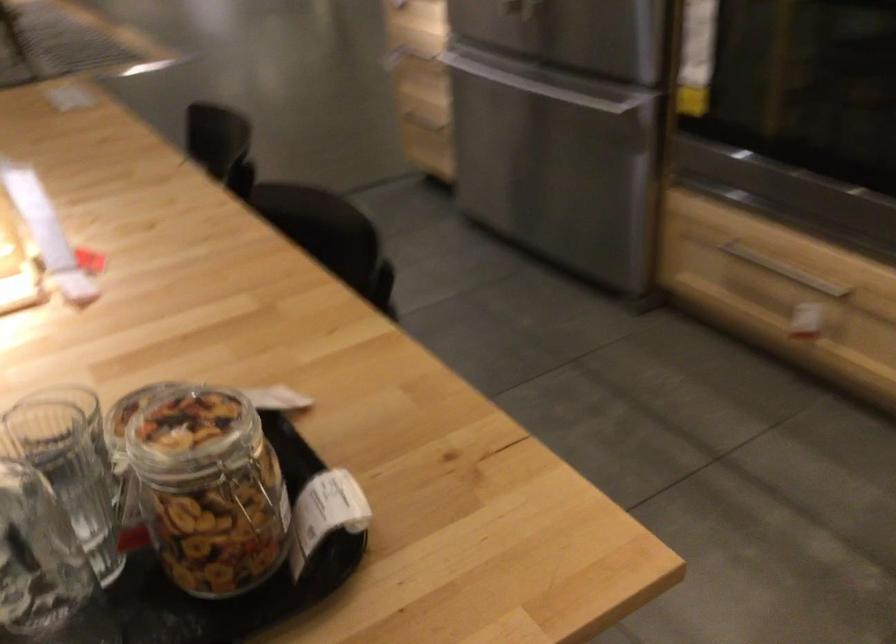
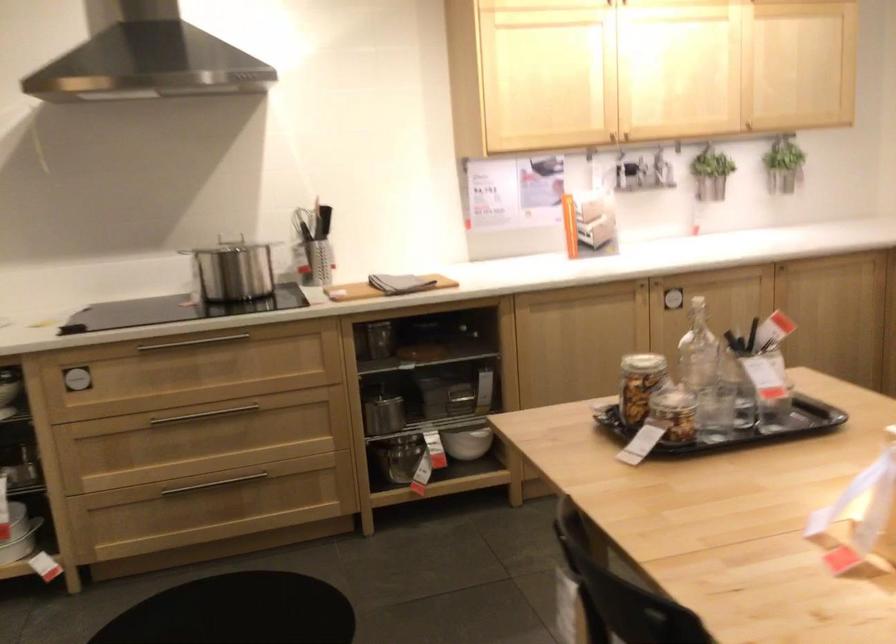
Where in the second image is the point corresponding to (153,440) from the first image?

(640, 384)